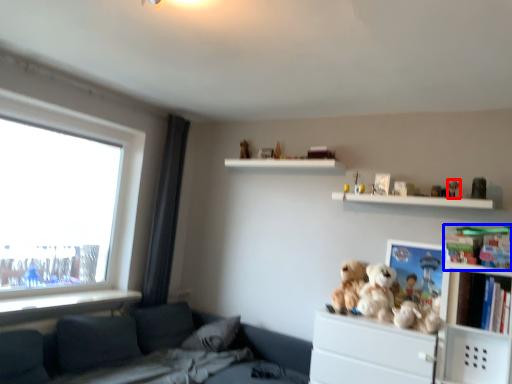
Question: Which point is further to the camera, toy (highlighted by a red box) or toy (highlighted by a blue box)?

Choices:
 (A) toy
 (B) toy

Answer: (A)